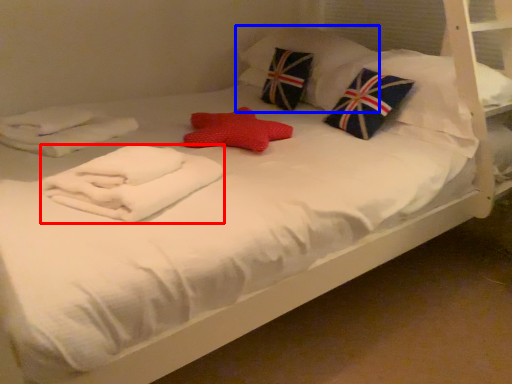
Question: Which point is closer to the camera, material (highlighted by a red box) or pillow (highlighted by a blue box)?

Choices:
 (A) material
 (B) pillow

Answer: (A)